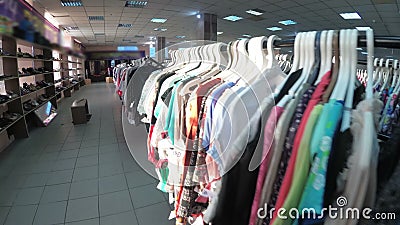
Find the location of a particular element. This screenshot has width=400, height=225. sitting bench is located at coordinates (83, 112).